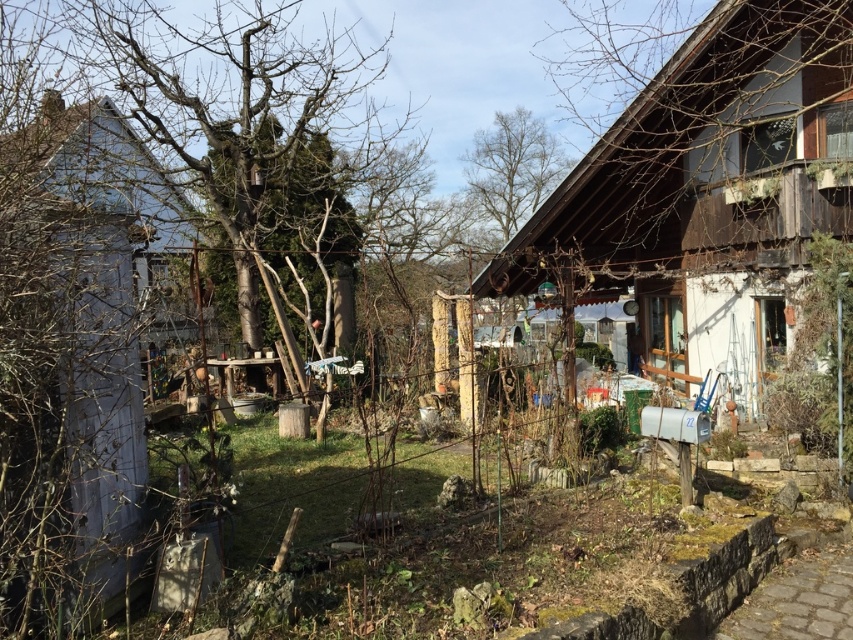
Question: Which of the following is the farthest from the observer?

Choices:
 (A) (759, 209)
 (B) (125, 300)
 (C) (221, 138)
 (D) (566, 161)

Answer: (D)

Question: Does wooden hut at right appear under white wood hut at left?

Choices:
 (A) no
 (B) yes

Answer: (B)

Question: Which of the following is the closest to the observer?

Choices:
 (A) (521, 109)
 (B) (646, 236)
 (C) (120, 65)

Answer: (C)

Question: Among these objects, which one is farthest from the camera?

Choices:
 (A) bare branches at left
 (B) white wood hut at left

Answer: (A)

Question: Does wooden hut at right appear on the left side of white wood hut at left?

Choices:
 (A) yes
 (B) no

Answer: (B)

Question: Can you confirm if wooden hut at right is thinner than white wood hut at left?

Choices:
 (A) no
 (B) yes

Answer: (A)